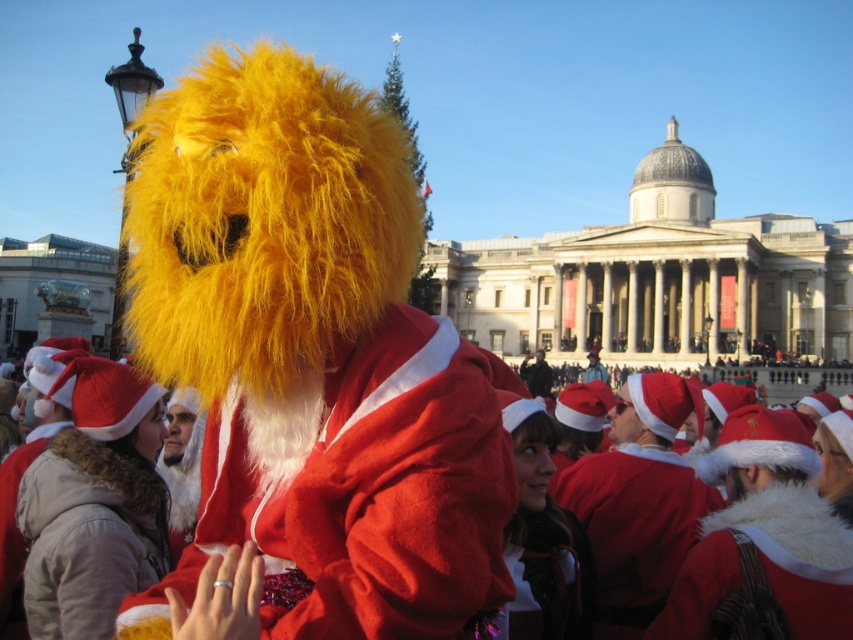
Is the position of fuzzy red santa suit at center more distant than that of black fuzzy hat at center?

No.

Who is more forward, (616, 529) or (527, 378)?

Point (616, 529) is in front.

The width and height of the screenshot is (853, 640). What do you see at coordinates (637, 502) in the screenshot?
I see `fuzzy red santa suit at center` at bounding box center [637, 502].

You are a GUI agent. You are given a task and a screenshot of the screen. Output one action in this format:
    pyautogui.click(x=<x>, y=<y>)
    Task: Click on the fuzzy red santa suit at center
    
    Given the screenshot: What is the action you would take?
    pyautogui.click(x=637, y=502)

Locate an element on the screen. fuzzy yellow mask at center is located at coordinates (308, 369).

Can you confirm if fuzzy yellow mask at center is positioned above black fuzzy hat at center?

Yes, fuzzy yellow mask at center is above black fuzzy hat at center.

Where is `fuzzy yellow mask at center`? Image resolution: width=853 pixels, height=640 pixels. fuzzy yellow mask at center is located at coordinates (308, 369).

Identify the location of fuzzy yellow mask at center. click(308, 369).

Between fuzzy yellow mask at center and fuzzy red santa suit at center, which one is positioned lower?

fuzzy red santa suit at center

Does fuzzy yellow mask at center have a smaller size compared to fuzzy red santa suit at center?

Actually, fuzzy yellow mask at center might be larger than fuzzy red santa suit at center.

Which is in front, point (283, 246) or point (648, 524)?

Point (283, 246)

Identify the location of fuzzy yellow mask at center. (308, 369).